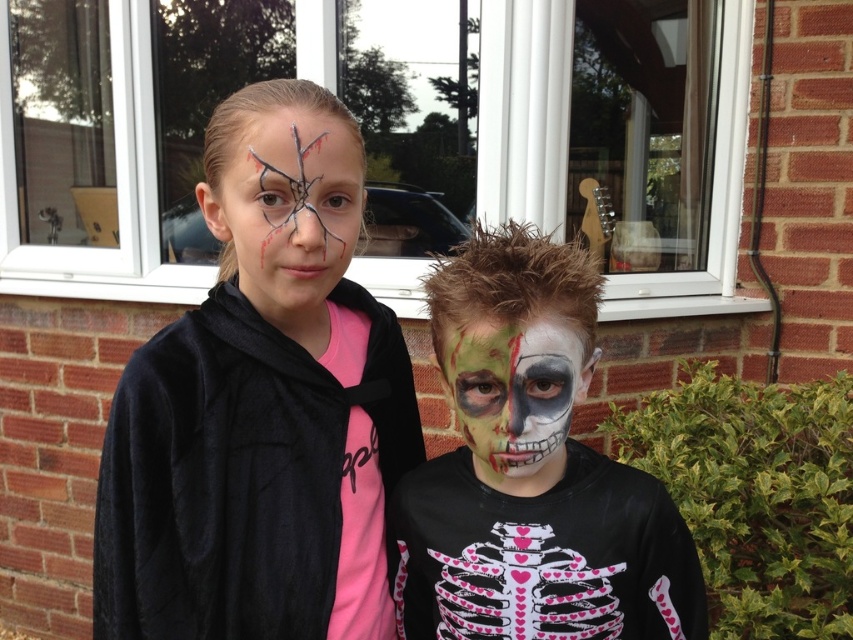
You are a photographer standing in front of the brick wall with large windows. You want to take a closeup shot of the pink matte skeleton shirt at center. Based on the distance provided, is the shirt within a 1 meter range from the camera?

The pink matte skeleton shirt at center is 97.83 centimeters away from the camera, which is within the 1 meter range. Therefore, the shirt is close enough for a closeup shot.

You are a costume designer preparing for a Halloween event. You have two costumes to prepare. The first costume includes the matte black jacket at left, and the second includes the pink matte skeleton shirt at center. According to the image provided, how are these two items arranged spatially?

The matte black jacket at left is positioned over the pink matte skeleton shirt at center, meaning the jacket is worn on top of the shirt.